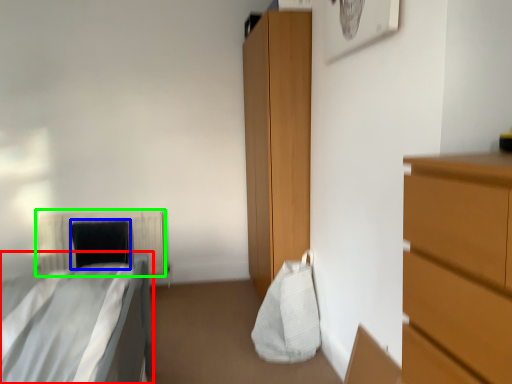
Question: Which object is the farthest from bed (highlighted by a red box)? Choose among these: pillow (highlighted by a blue box) or radiator (highlighted by a green box).

Choices:
 (A) pillow
 (B) radiator

Answer: (B)